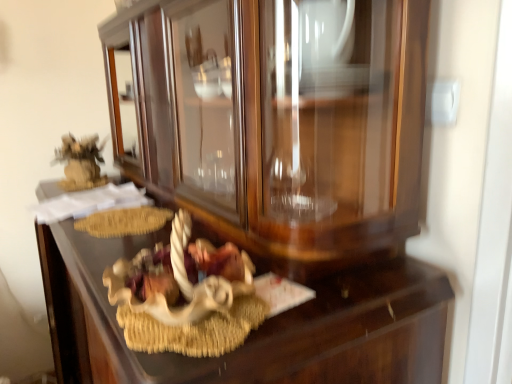
Where is `free point to the right of white matte nativity scene at center`? The image size is (512, 384). free point to the right of white matte nativity scene at center is located at coordinates (307, 298).